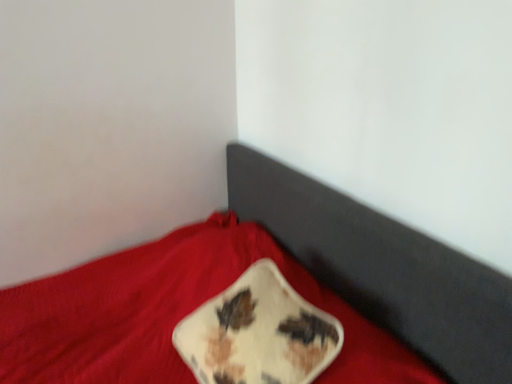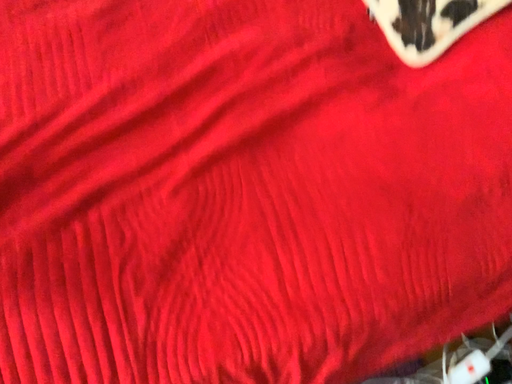
Question: Which way did the camera rotate in the video?

Choices:
 (A) rotated right
 (B) rotated left

Answer: (B)